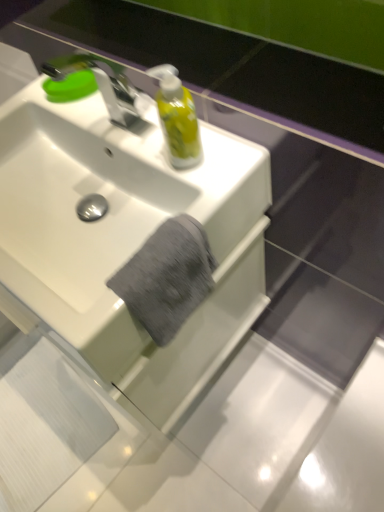
Locate an element on the screen. The image size is (384, 512). vacant area that is in front of green matte soap at upper left is located at coordinates 100,124.